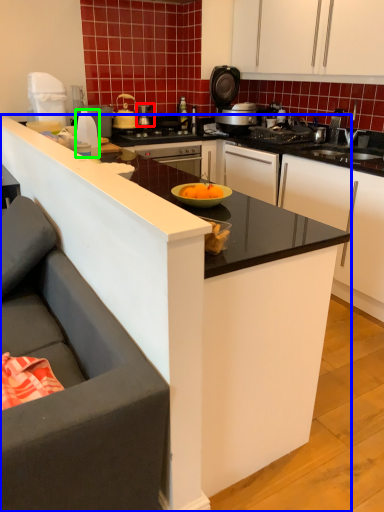
Question: Based on their relative distances, which object is nearer to kitchen appliance (highlighted by a red box)? Choose from countertop (highlighted by a blue box) and kitchen appliance (highlighted by a green box).

Choices:
 (A) countertop
 (B) kitchen appliance

Answer: (B)